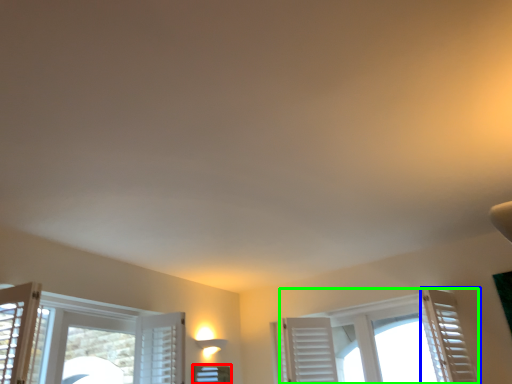
Question: Considering the real-world distances, which object is closest to window (highlighted by a red box)? curtain (highlighted by a blue box) or window (highlighted by a green box).

Choices:
 (A) curtain
 (B) window

Answer: (B)